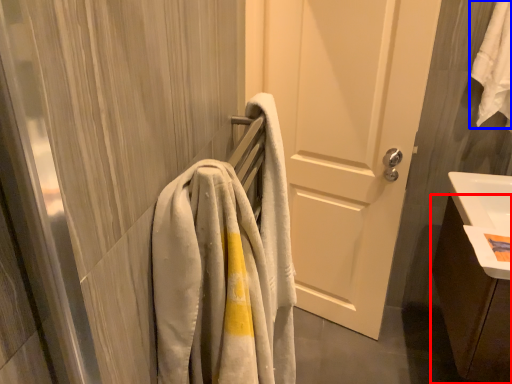
Question: Which point is further to the camera, bathroom cabinet (highlighted by a red box) or bath towel (highlighted by a blue box)?

Choices:
 (A) bathroom cabinet
 (B) bath towel

Answer: (B)